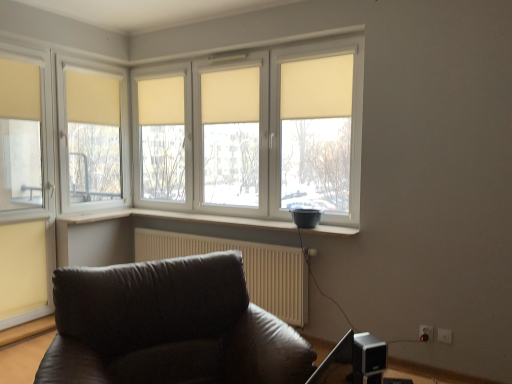
At what (x,y) coordinates should I click in order to perform the action: click on empty space that is ontop of beige fabric curtain at center, acting as the fourth curtain starting from the left (from a real-world perspective). Please return your answer as a coordinate pair (x, y). The height and width of the screenshot is (384, 512). Looking at the image, I should click on (231, 66).